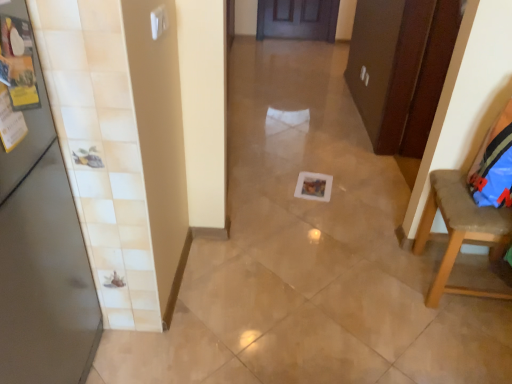
What do you see at coordinates (465, 219) in the screenshot? Image resolution: width=512 pixels, height=384 pixels. I see `brown fabric chair at right` at bounding box center [465, 219].

Find the location of `brown fabric chair at right`. brown fabric chair at right is located at coordinates (465, 219).

Image resolution: width=512 pixels, height=384 pixels. What do you see at coordinates (42, 261) in the screenshot?
I see `metallic gray door at left` at bounding box center [42, 261].

Find the location of `metallic gray door at left`. metallic gray door at left is located at coordinates (42, 261).

Locate an element on the screen. brown fabric chair at right is located at coordinates (465, 219).

Considering the positions of objects metallic gray door at left and brown fabric chair at right in the image provided, who is more to the left, metallic gray door at left or brown fabric chair at right?

Positioned to the left is metallic gray door at left.

Is metallic gray door at left closer to the viewer compared to brown fabric chair at right?

Yes, the depth of metallic gray door at left is less than that of brown fabric chair at right.

Which is closer, (20,376) or (480,155)?

Point (20,376) is positioned closer to the camera compared to point (480,155).

From the image's perspective, is metallic gray door at left positioned above or below brown fabric chair at right?

Based on their image positions, metallic gray door at left is located beneath brown fabric chair at right.

From a real-world perspective, who is located lower, metallic gray door at left or brown fabric chair at right?

brown fabric chair at right, from a real-world perspective.

Between metallic gray door at left and brown fabric chair at right, which one has larger width?

With larger width is brown fabric chair at right.

From the picture: From their relative heights in the image, would you say metallic gray door at left is taller or shorter than brown fabric chair at right?

Considering their sizes, metallic gray door at left has more height than brown fabric chair at right.

Can you confirm if metallic gray door at left is bigger than brown fabric chair at right?

Correct, metallic gray door at left is larger in size than brown fabric chair at right.

Would you say metallic gray door at left contains brown fabric chair at right?

That's incorrect, brown fabric chair at right is not inside metallic gray door at left.

Based on the photo, is there a large distance between metallic gray door at left and brown fabric chair at right?

Yes.

Consider the image. Could you tell me if metallic gray door at left is facing brown fabric chair at right?

Yes, metallic gray door at left is oriented towards brown fabric chair at right.

What's the angular difference between metallic gray door at left and brown fabric chair at right's facing directions?

174 degrees.

Locate an element on the screen. Image resolution: width=512 pixels, height=384 pixels. chair on the right of metallic gray door at left is located at coordinates (465, 219).

Is brown fabric chair at right to the left of metallic gray door at left from the viewer's perspective?

In fact, brown fabric chair at right is to the right of metallic gray door at left.

Considering the positions of objects brown fabric chair at right and metallic gray door at left in the image provided, who is in front, brown fabric chair at right or metallic gray door at left?

Positioned in front is metallic gray door at left.

Is point (438, 294) closer or farther from the camera than point (89, 351)?

Clearly, point (438, 294) is more distant from the camera than point (89, 351).

From the image's perspective, is brown fabric chair at right on metallic gray door at left?

Yes.

From a real-world perspective, does brown fabric chair at right stand above metallic gray door at left?

No, from a real-world perspective, brown fabric chair at right is not above metallic gray door at left.

Does brown fabric chair at right have a lesser width compared to metallic gray door at left?

No.

Does brown fabric chair at right have a greater height compared to metallic gray door at left?

In fact, brown fabric chair at right may be shorter than metallic gray door at left.

Which of these two, brown fabric chair at right or metallic gray door at left, is smaller?

With smaller size is brown fabric chair at right.

Would you say brown fabric chair at right is inside or outside metallic gray door at left?

brown fabric chair at right exists outside the volume of metallic gray door at left.

Are brown fabric chair at right and metallic gray door at left beside each other?

No, brown fabric chair at right is not beside metallic gray door at left.

Is brown fabric chair at right positioned with its back to metallic gray door at left?

No, brown fabric chair at right is not facing the opposite direction of metallic gray door at left.

Locate an element on the screen. The width and height of the screenshot is (512, 384). door on the left side of brown fabric chair at right is located at coordinates (42, 261).

The height and width of the screenshot is (384, 512). What are the coordinates of `door above the brown fabric chair at right (from a real-world perspective)` in the screenshot? It's located at (42, 261).

Where is `door that appears in front of the brown fabric chair at right`? door that appears in front of the brown fabric chair at right is located at coordinates (42, 261).